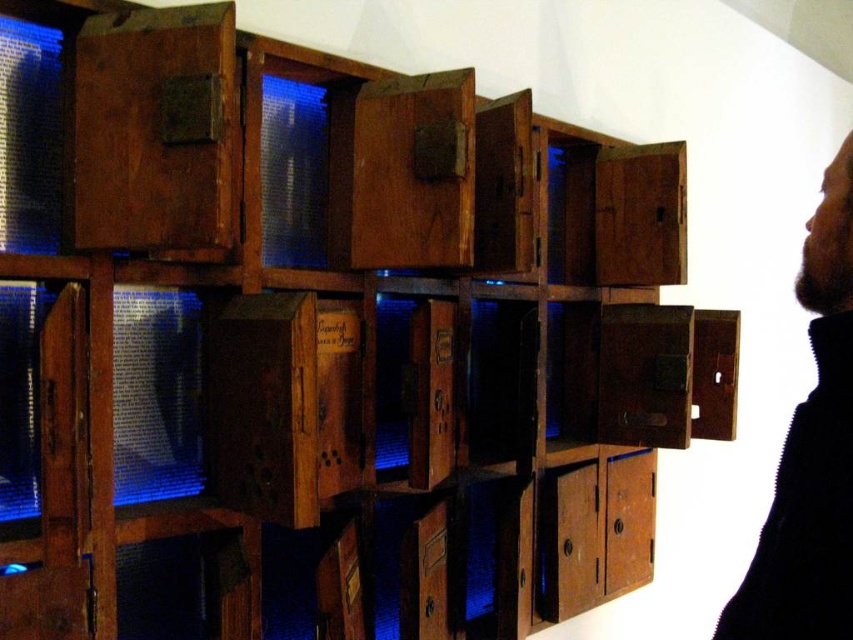
You are organizing a storage area and need to place a new item between the bearded black sweater at right and the rustic wood drawer at lower right. Is there enough space between them to fit a 10 cm wide item?

The bearded black sweater at right is in front of the rustic wood drawer at lower right, so there is no space between them to fit a 10 cm wide item.

You are standing in front of the boxes and need to place a 5 feet long item between the bearded black sweater at right and the rustic wood drawer at lower right. Can you fit it there?

The distance between the bearded black sweater at right and rustic wood drawer at lower right is 4.68 feet, which is shorter than the 5 feet long item. Therefore, the item cannot be placed there.

You are standing in front of the boxes and see the bearded black sweater at right. If you want to pick it up, will you need to move closer?

The bearded black sweater at right is 23.71 inches away from the viewer, so you need to move closer to pick it up.